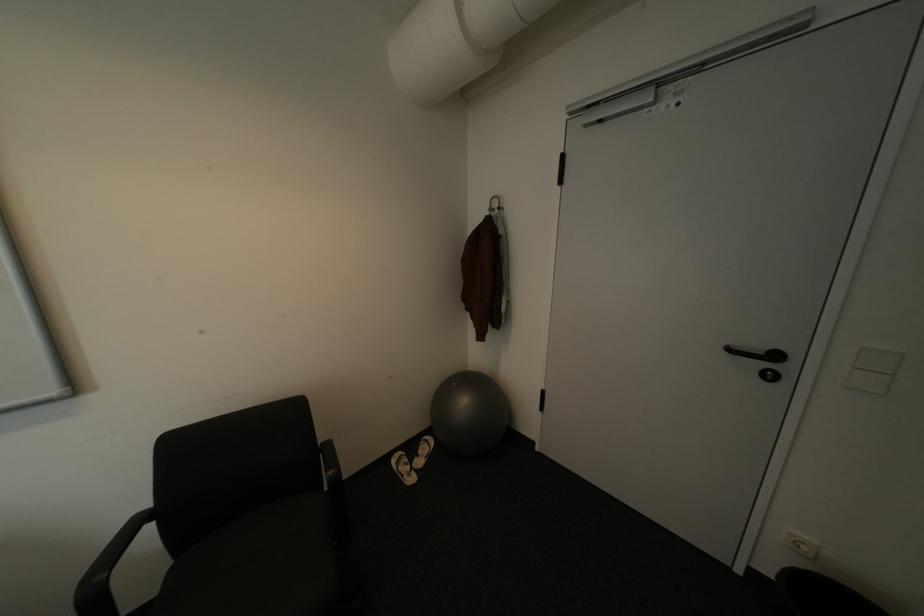
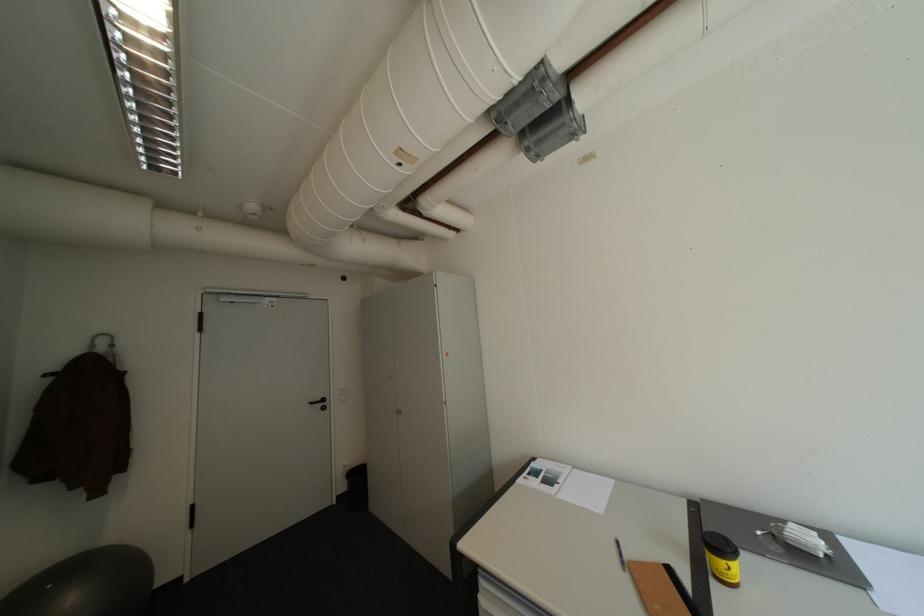
Find the pixel in the second image that matches point (505, 205) in the first image.

(113, 342)